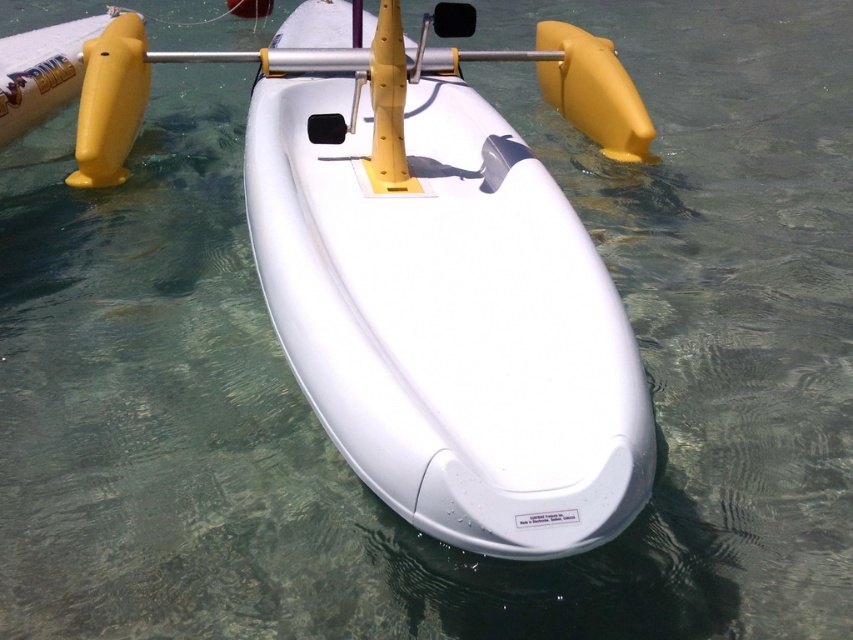
You are a safety inspector checking the storage area of the hydrofoil boat. You notice the white matte kayak at center and the yellow matte paddle at center. Which object should be stored first if you need to place them vertically in a compartment that can only accommodate one item at a time?

The white matte kayak at center should be stored first because it is taller than the yellow matte paddle at center, and the compartment can only hold one item at a time.

You are a safety inspector checking the hydrofoil boat. The safety guidelines require that the white matte kayak at center must be at least 3 meters away from the yellow matte paddle at center to prevent collision during high speeds. Based on the image, does the current placement meet the safety requirement?

The white matte kayak at center is 2.84 meters from the yellow matte paddle at center, which is less than the required 3 meters. Therefore, the current placement does not meet the safety requirement.